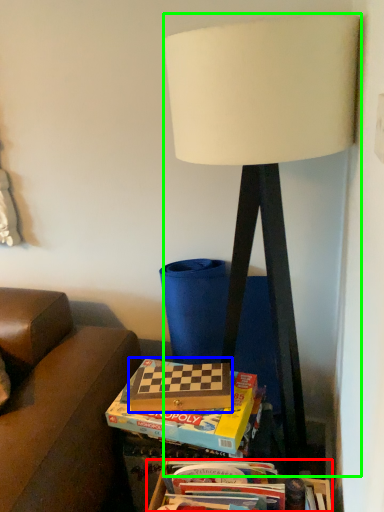
Question: Which object is the closest to the box (highlighted by a red box)? Choose among these: paperback book (highlighted by a blue box) or lamp (highlighted by a green box).

Choices:
 (A) paperback book
 (B) lamp

Answer: (A)